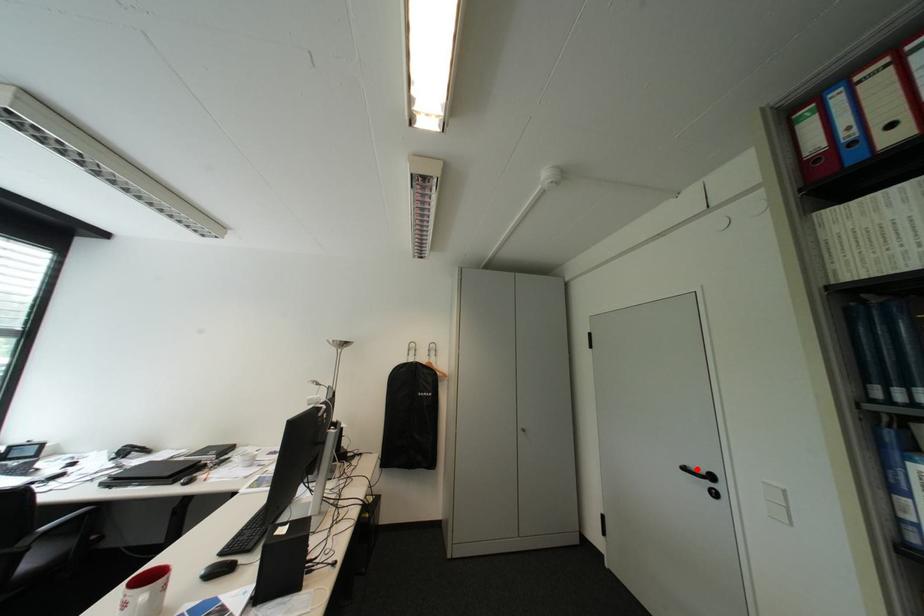
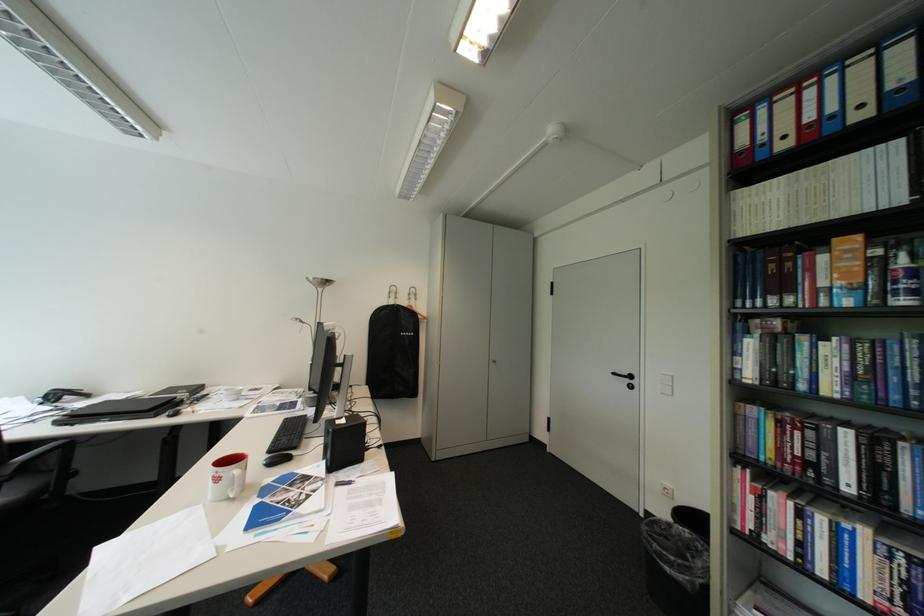
The point at the highlighted location is marked in the first image. Where is the corresponding point in the second image?

(626, 374)